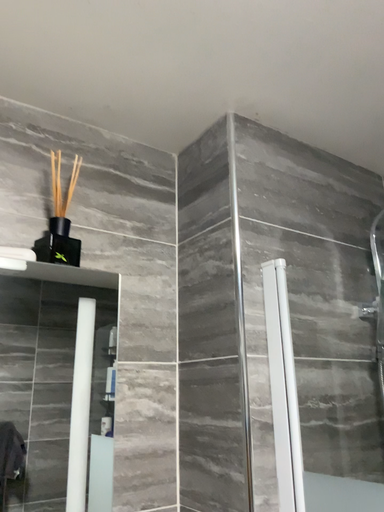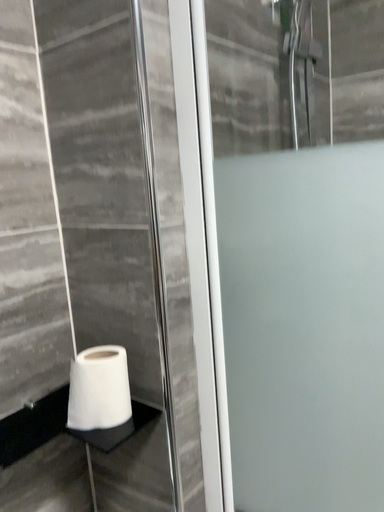
Question: Which way did the camera rotate in the video?

Choices:
 (A) rotated left
 (B) rotated right

Answer: (B)